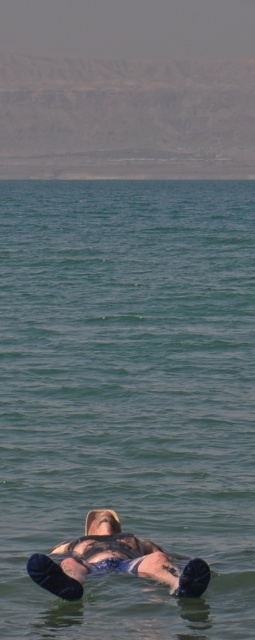
You are a lifeguard at the Dead Sea and need to reach the blue fabric person at center from the green liquid water at center. Can you swim to them in 2 minutes if you swim at a speed of 1.5 meters per second?

The distance between the green liquid water at center and the blue fabric person at center is 16.05 meters. Swimming at 1.5 meters per second, it would take 10.7 seconds to cover that distance. Therefore, yes, you can reach them in well under 2 minutes.

You are a lifeguard at the Dead Sea and need to ensure the safety of swimmers. Given the scene, can you confirm if the green liquid water at center is spacious enough to accommodate the blue fabric person at center comfortably?

The green liquid water at center has a larger size compared to blue fabric person at center, so yes, the water is spacious enough to accommodate the person comfortably.

You are standing at the edge of the Dead Sea. You see green liquid water at center located at point (128, 396). Can you reach the green liquid water at center from your current position?

Yes, you can reach the green liquid water at center located at point (128, 396) because it is in the center of the Dead Sea, which is accessible from the edge by walking into the water.